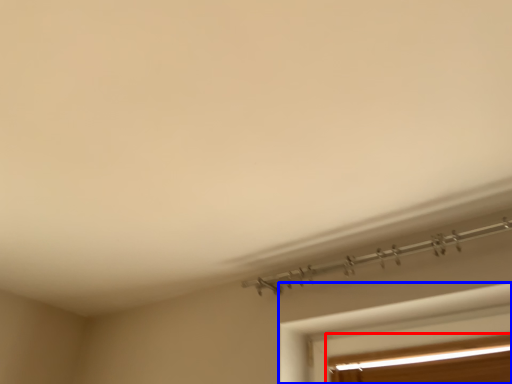
Question: Which object appears closest to the camera in this image, window (highlighted by a red box) or window (highlighted by a blue box)?

Choices:
 (A) window
 (B) window

Answer: (B)